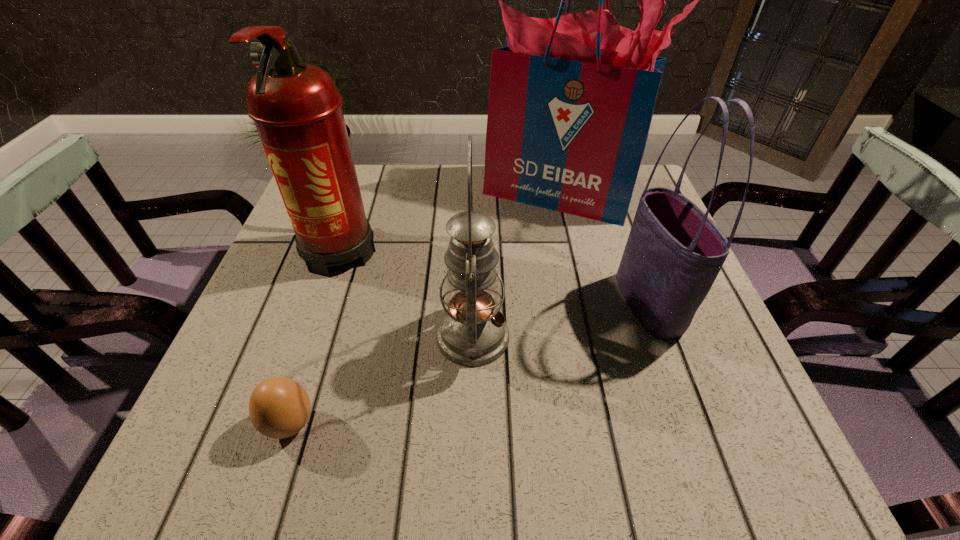
I want to click on object present at the far right corner, so click(x=571, y=99).

This screenshot has height=540, width=960. Find the location of `vacant space at the far edge`. vacant space at the far edge is located at coordinates (429, 201).

Find the location of `blank space at the near edge`. blank space at the near edge is located at coordinates (482, 474).

At what (x,y) coordinates should I click in order to perform the action: click on free space at the right edge of the desktop. Please return your answer as a coordinate pair (x, y). Looking at the image, I should click on (752, 413).

Where is `free spot at the far right corner of the desktop`? The height and width of the screenshot is (540, 960). free spot at the far right corner of the desktop is located at coordinates (641, 167).

In the image, there is a desktop. Where is `vacant area at the near right corner`? vacant area at the near right corner is located at coordinates (695, 457).

Locate an element on the screen. free point between the oil lamp and the grocery bag is located at coordinates (516, 265).

Where is `vacant area that lies between the grocery bag and the tote bag`? This screenshot has height=540, width=960. vacant area that lies between the grocery bag and the tote bag is located at coordinates (603, 249).

The image size is (960, 540). I want to click on free spot between the tote bag and the oil lamp, so click(561, 320).

I want to click on unoccupied area between the fire extinguisher and the shortest object, so click(x=315, y=336).